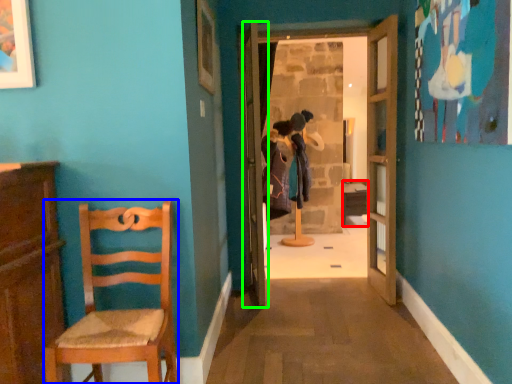
Question: Which is nearer to the table (highlighted by a red box)? chair (highlighted by a blue box) or door (highlighted by a green box).

Choices:
 (A) chair
 (B) door

Answer: (B)